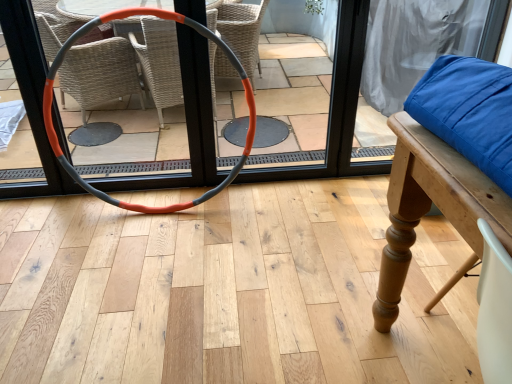
Question: Is orange-gray rubber hula hoop at center next to orange rubber hoop at center and touching it?

Choices:
 (A) yes
 (B) no

Answer: (B)

Question: Does orange-gray rubber hula hoop at center appear on the left side of orange rubber hoop at center?

Choices:
 (A) yes
 (B) no

Answer: (A)

Question: Is orange-gray rubber hula hoop at center smaller than orange rubber hoop at center?

Choices:
 (A) no
 (B) yes

Answer: (A)

Question: From a real-world perspective, is orange-gray rubber hula hoop at center below orange rubber hoop at center?

Choices:
 (A) no
 (B) yes

Answer: (B)

Question: Is orange-gray rubber hula hoop at center closer to camera compared to orange rubber hoop at center?

Choices:
 (A) yes
 (B) no

Answer: (A)

Question: Is orange-gray rubber hula hoop at center positioned beyond the bounds of orange rubber hoop at center?

Choices:
 (A) no
 (B) yes

Answer: (B)

Question: Is orange rubber hoop at center far from orange-gray rubber hula hoop at center?

Choices:
 (A) no
 (B) yes

Answer: (A)

Question: Can you confirm if orange rubber hoop at center is positioned to the left of orange-gray rubber hula hoop at center?

Choices:
 (A) yes
 (B) no

Answer: (B)

Question: Is orange rubber hoop at center facing towards orange-gray rubber hula hoop at center?

Choices:
 (A) no
 (B) yes

Answer: (B)

Question: Is orange rubber hoop at center completely or partially outside of orange-gray rubber hula hoop at center?

Choices:
 (A) no
 (B) yes

Answer: (B)

Question: Is orange rubber hoop at center placed right next to orange-gray rubber hula hoop at center?

Choices:
 (A) no
 (B) yes

Answer: (A)

Question: Would you say orange rubber hoop at center contains orange-gray rubber hula hoop at center?

Choices:
 (A) yes
 (B) no

Answer: (B)

Question: Considering their positions, is orange-gray rubber hula hoop at center located in front of or behind orange rubber hoop at center?

Choices:
 (A) front
 (B) behind

Answer: (A)